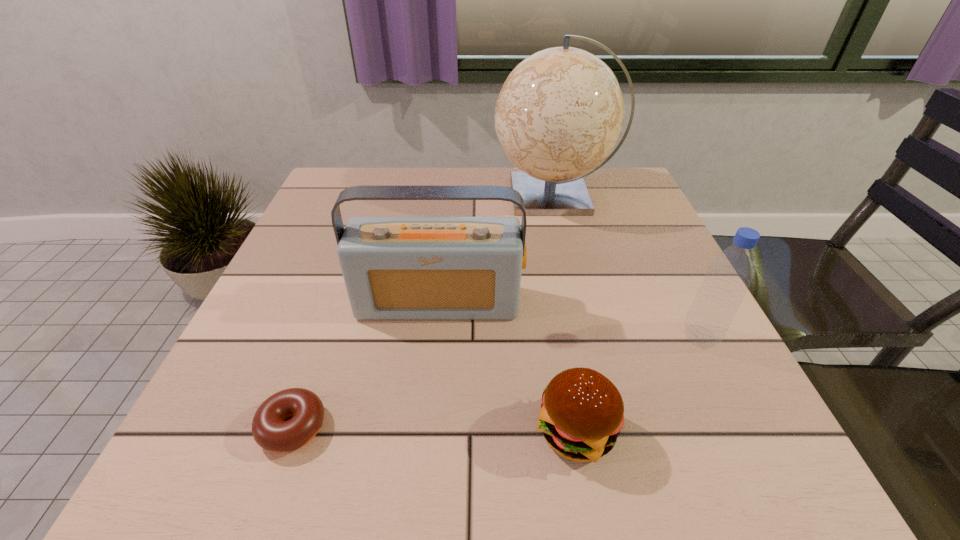
Where is `blank area located 0.300m on the left of the bottle`? The height and width of the screenshot is (540, 960). blank area located 0.300m on the left of the bottle is located at coordinates (518, 337).

Locate an element on the screen. free space located 0.140m on the left of the fourth tallest object is located at coordinates (442, 431).

I want to click on free space located 0.320m on the back of the shortest object, so click(x=348, y=271).

In order to click on object at the far edge in this screenshot , I will do `click(560, 112)`.

Locate an element on the screen. hamburger positioned at the near edge is located at coordinates (582, 413).

You are a GUI agent. You are given a task and a screenshot of the screen. Output one action in this format:
    pyautogui.click(x=<x>, y=<y>)
    Task: Click on the doughnut that is at the near edge
    This screenshot has height=540, width=960.
    Given the screenshot: What is the action you would take?
    pyautogui.click(x=271, y=431)

What are the coordinates of `object present at the left edge` in the screenshot? It's located at (271, 431).

This screenshot has width=960, height=540. I want to click on globe situated at the right edge, so click(x=560, y=112).

Where is `bottle at the right edge`? The image size is (960, 540). bottle at the right edge is located at coordinates (729, 275).

Where is `object situated at the near left corner`? This screenshot has height=540, width=960. object situated at the near left corner is located at coordinates (271, 431).